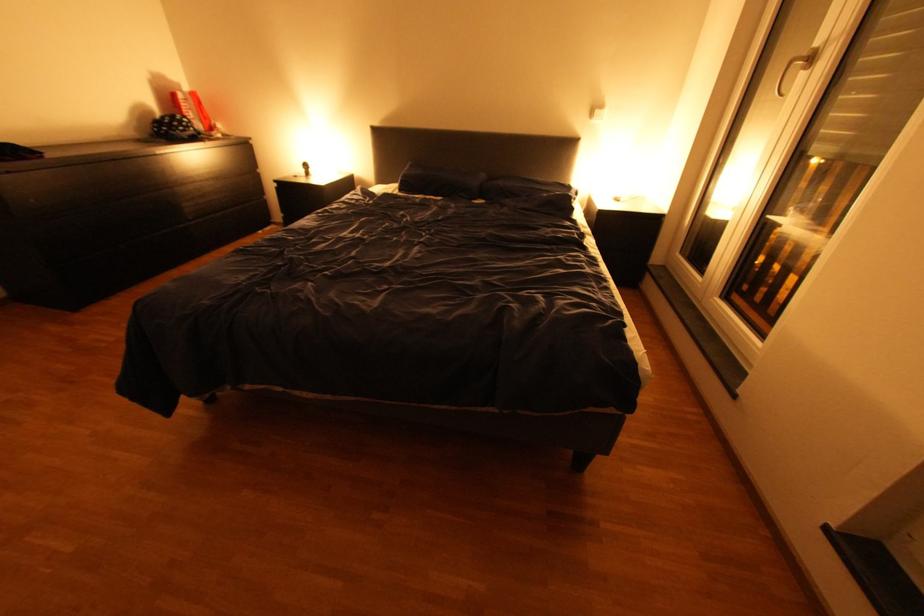
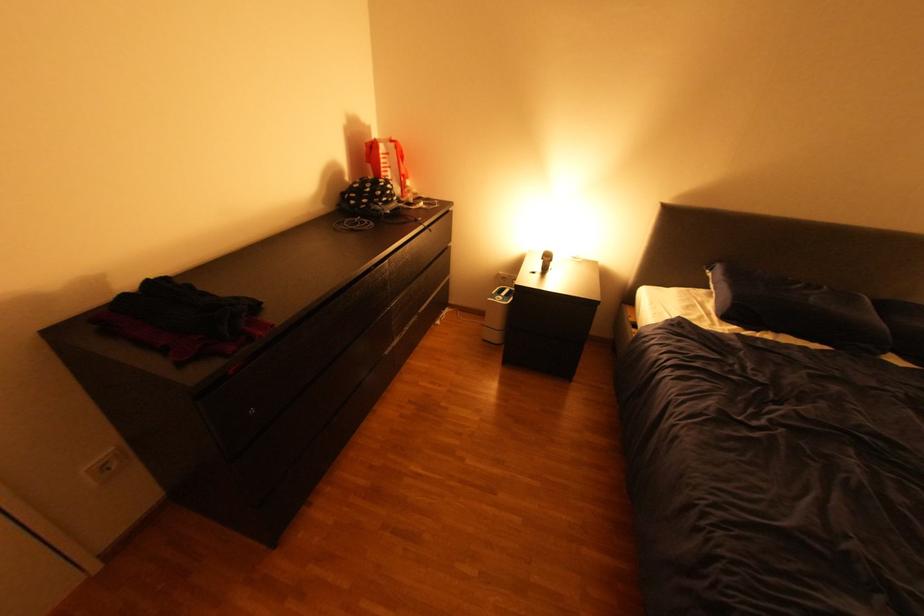
Question: I am providing you with two images of the same scene from different viewpoints. After the viewpoint changes to image2, which objects are now occluded?

Choices:
 (A) dark blue pillow
 (B) dark drawer pull
 (C) small table lamp
 (D) none of these

Answer: (D)